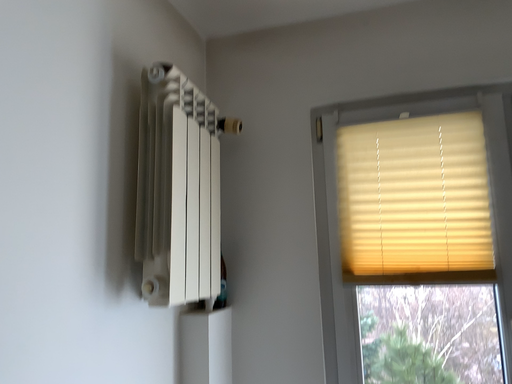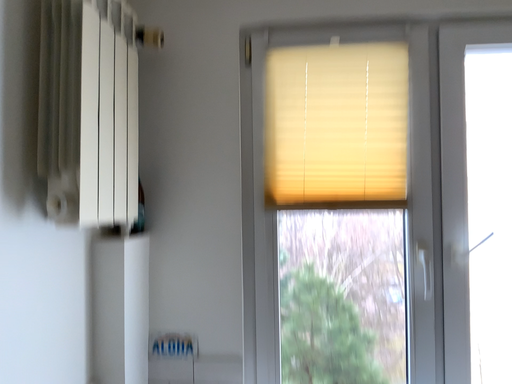
Question: Which way did the camera rotate in the video?

Choices:
 (A) rotated downward
 (B) rotated upward

Answer: (A)